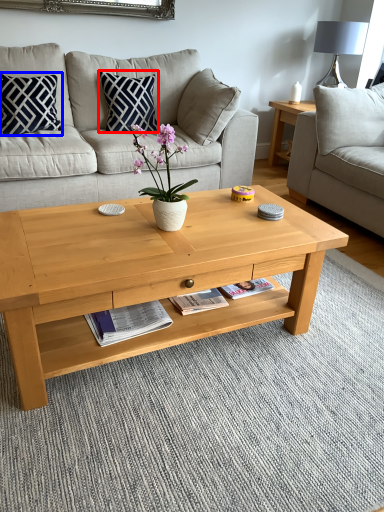
Question: Which object appears closest to the camera in this image, pillow (highlighted by a red box) or pillow (highlighted by a blue box)?

Choices:
 (A) pillow
 (B) pillow

Answer: (B)